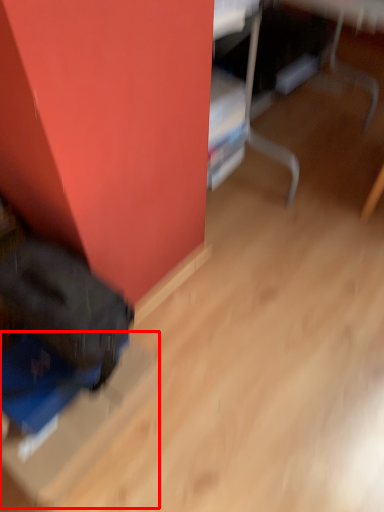
Question: From the image's perspective, where is cardboard box (annotated by the red box) located in relation to furniture in the image?

Choices:
 (A) below
 (B) above

Answer: (A)